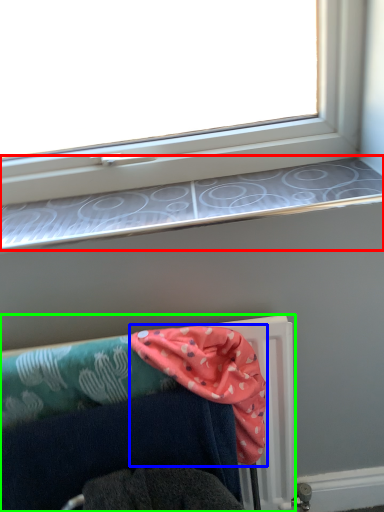
Question: Considering the real-world distances, which object is farthest from window sill (highlighted by a red box)? scarf (highlighted by a blue box) or furniture (highlighted by a green box)?

Choices:
 (A) scarf
 (B) furniture

Answer: (B)